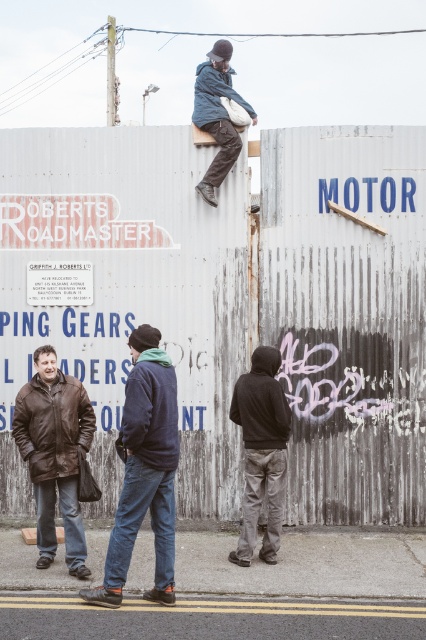
You are a photographer positioned in front of the metal wall. You want to take a photo that includes both the dark blue jacket at center and the denim jacket at upper center. Which jacket will appear larger in the photo?

The dark blue jacket at center will appear larger in the photo because it is closer to the viewer than the denim jacket at upper center.

You are standing at the center of the image. You need to locate the brown leather jacket at lower left. Which direction should you turn to face it?

The brown leather jacket at lower left is located at point (54, 452), which is to the left side of the image. Therefore, you should turn to your left to face it.